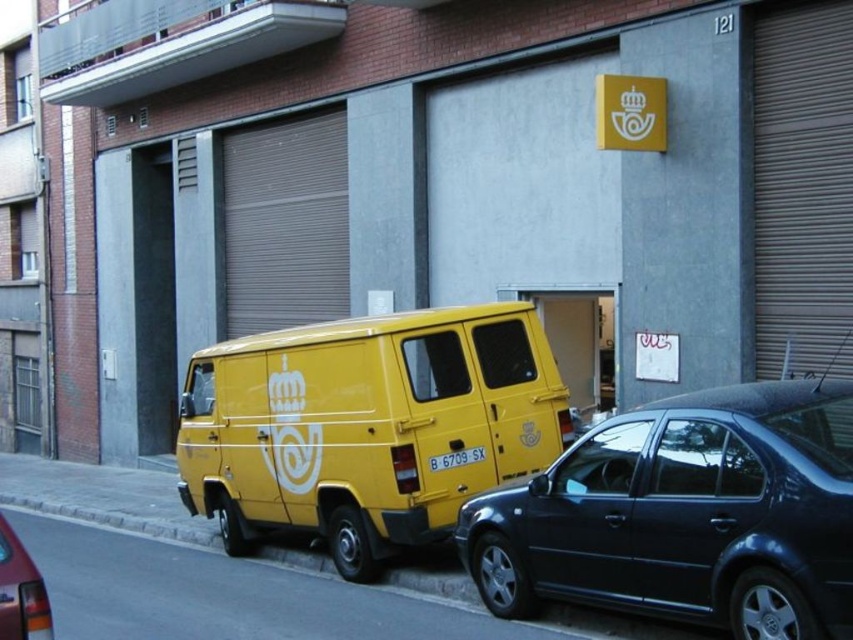
You are a delivery person standing at the point with coordinates point (x=635, y=413). You need to deliver a package to a location marked by point (x=347, y=557). Which direction should you move to reach the destination?

You should move backward because point (x=635, y=413) is in front of point (x=347, y=557), meaning the destination is behind your current position.

You are a delivery driver who just arrived at the urban street scene. You see the concrete at lower left and the shiny red tail light at lower left. Which one takes up more space in the image?

The shiny red tail light at lower left takes up more space than the concrete at lower left because the concrete at lower left occupies less space than shiny red tail light at lower left.